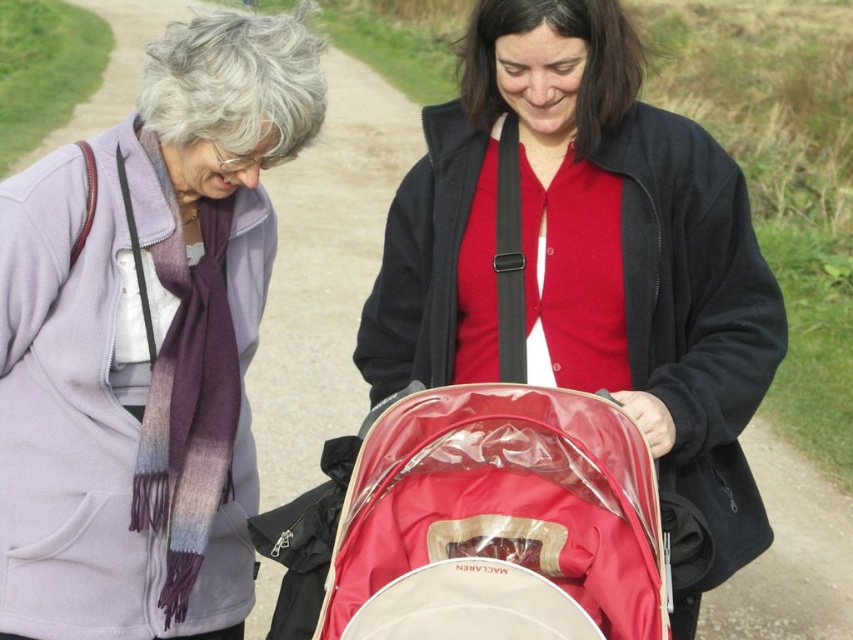
You are a photographer trying to capture the matte purple scarf at upper left and the red fabric baby carriage at center in the same frame. Which object should you focus on first to ensure both are in the frame without zooming in or out?

The matte purple scarf at upper left is bigger than the red fabric baby carriage at center, so you should focus on the matte purple scarf at upper left first to ensure both are in the frame without zooming in or out.

You are a photographer planning to take a portrait of the two people in the scene. Considering the positioning of the matte purple scarf at upper left and the red fabric baby carriage at center, which object should you ensure stays within the frame to avoid blocking the subjects?

The matte purple scarf at upper left is much taller than the red fabric baby carriage at center, so you should ensure the matte purple scarf at upper left stays within the frame to avoid blocking the subjects.